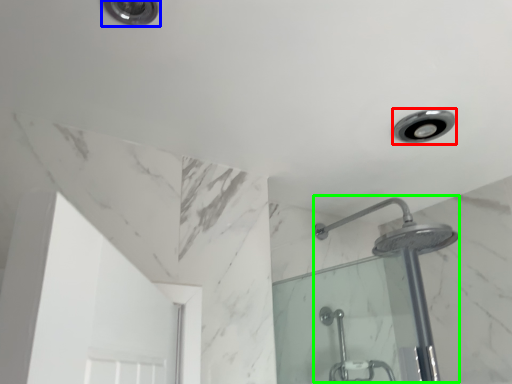
Question: Which object is the closest to the light fixture (highlighted by a red box)? Choose among these: light fixture (highlighted by a blue box) or shower (highlighted by a green box).

Choices:
 (A) light fixture
 (B) shower

Answer: (B)